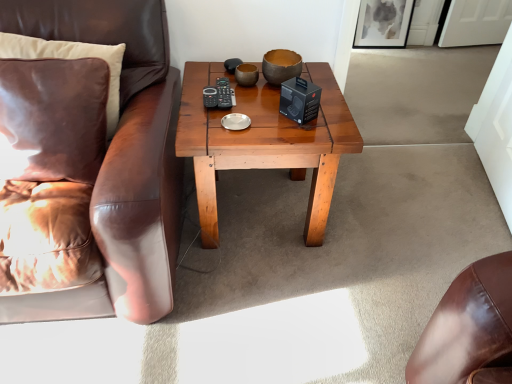
Find the location of a particular element. This screenshot has height=384, width=512. free space to the right of wooden coffee table at center is located at coordinates (386, 223).